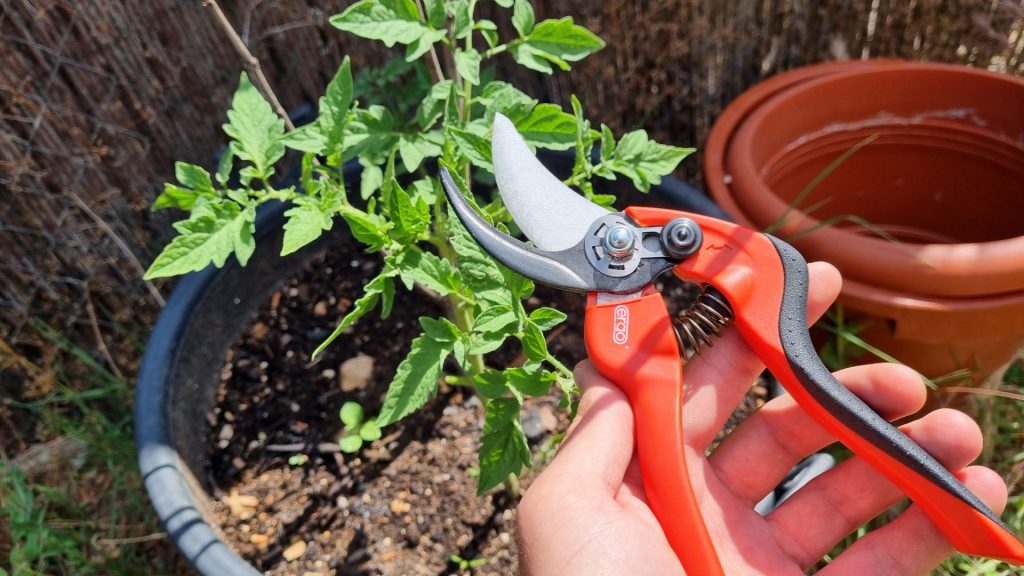
At what (x,y) coordinates should I click in order to perform the action: click on blue pot. Please return your answer as a coordinate pair (x, y). This screenshot has width=1024, height=576. Looking at the image, I should click on (166, 401).